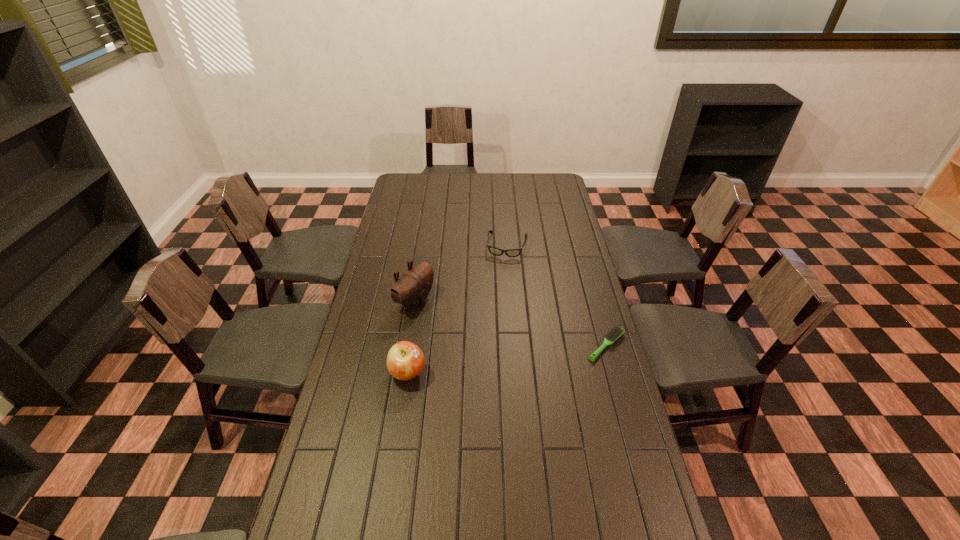
Find the location of a particular element. free region located 0.180m on the front-facing side of the farthest object is located at coordinates (499, 287).

Where is `free region located 0.050m on the front-facing side of the farthest object`? free region located 0.050m on the front-facing side of the farthest object is located at coordinates (503, 267).

Where is `blank space located 0.220m with the flap open on the pouch`? The image size is (960, 540). blank space located 0.220m with the flap open on the pouch is located at coordinates (478, 335).

This screenshot has width=960, height=540. Identify the location of vacant space located 0.370m with the flap open on the pouch. (515, 354).

I want to click on blank space located 0.390m with the flap open on the pouch, so click(519, 356).

Locate an element on the screen. apple that is at the left edge is located at coordinates (405, 360).

In order to click on pouch that is at the left edge in this screenshot , I will do `click(411, 290)`.

The width and height of the screenshot is (960, 540). What are the coordinates of `object that is at the right edge` in the screenshot? It's located at (617, 331).

The width and height of the screenshot is (960, 540). I want to click on free region at the far edge of the desktop, so (x=499, y=179).

This screenshot has height=540, width=960. In the image, there is a desktop. Find the location of `free space at the left edge`. free space at the left edge is located at coordinates (396, 238).